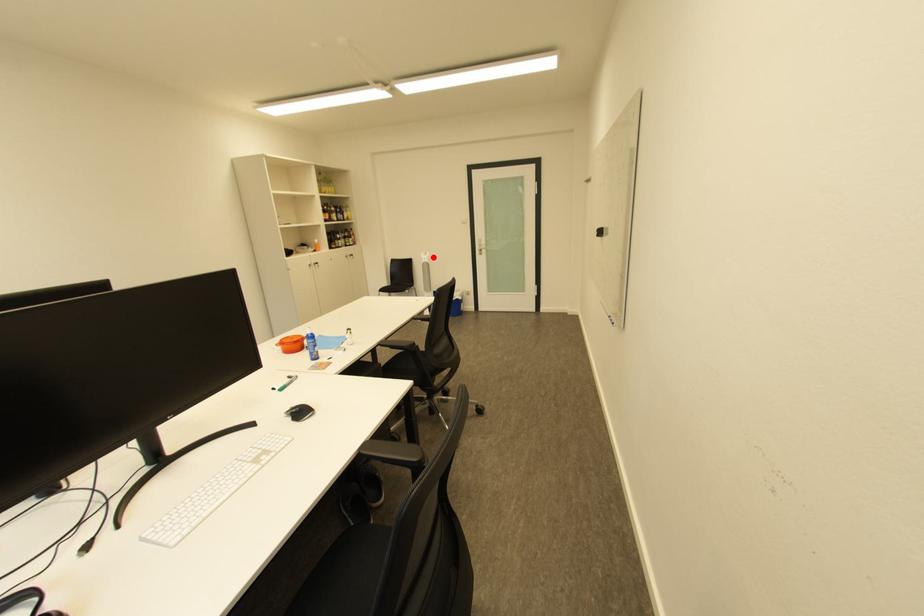
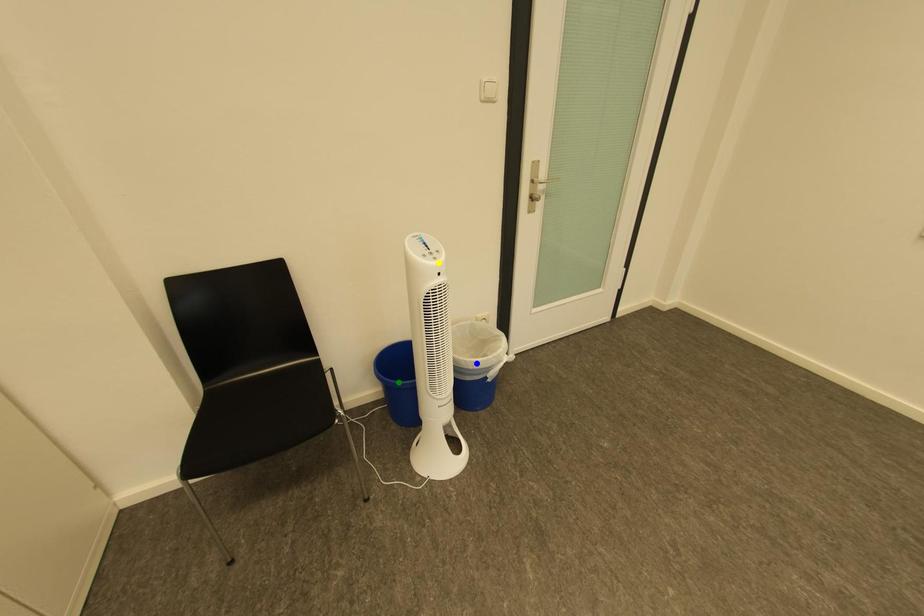
Question: I am providing you with two images of the same scene from different viewpoints. A red point is marked on the first image. You are given multiple points on the second image. In image 2, which mark is for the same physical point as the one in image 1?

Choices:
 (A) green point
 (B) yellow point
 (C) blue point

Answer: (B)